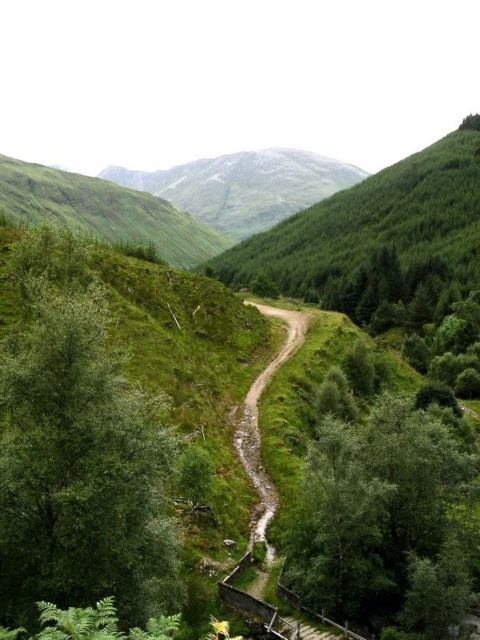
You are a hiker standing at the start of the dirt path. You want to reach the green grassy mountain at upper center. Which direction should you go relative to the green leafy tree at left?

The green grassy mountain at upper center is located to the right of the green leafy tree at left. Since the green leafy tree at left is shorter than the green grassy mountain at upper center, you should head towards the right side of the tree to reach the mountain.

You are hiking along the winding dirt path and want to take a photo of the green leafy tree at left and the green grassy mountain at upper center. Which object will appear larger in your photo?

The green leafy tree at left will appear larger in your photo because it is closer to you than the green grassy mountain at upper center.

You are a hiker planning to walk from the green leafy tree at left to the green grassy mountain at upper center. According to the map, the distance between them is 533.43 meters. If your average walking speed is 4 km per hour, how many minutes will it take you to reach the mountain?

The distance between the green leafy tree at left and the green grassy mountain at upper center is 533.43 meters. Converting this to kilometers gives 0.53343 km. At a walking speed of 4 km per hour, dividing distance by speed yields 0.53343 km divided by 4 km per hour equals approximately 0.133 hours. Multiplying by 60 minutes gives about 8 minutes. Therefore, it will take approximately 8 minutes to reach the green grassy mountain at upper center.